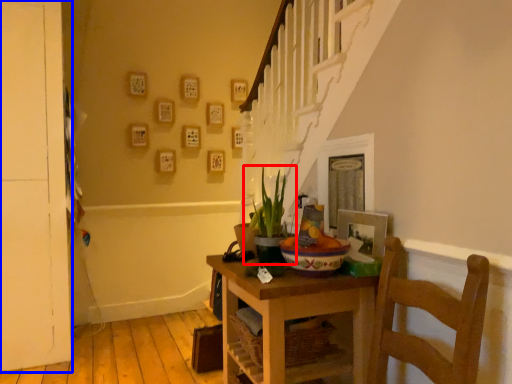
Question: Which of the following is the closest to the observer, houseplant (highlighted by a red box) or door (highlighted by a blue box)?

Choices:
 (A) houseplant
 (B) door

Answer: (A)